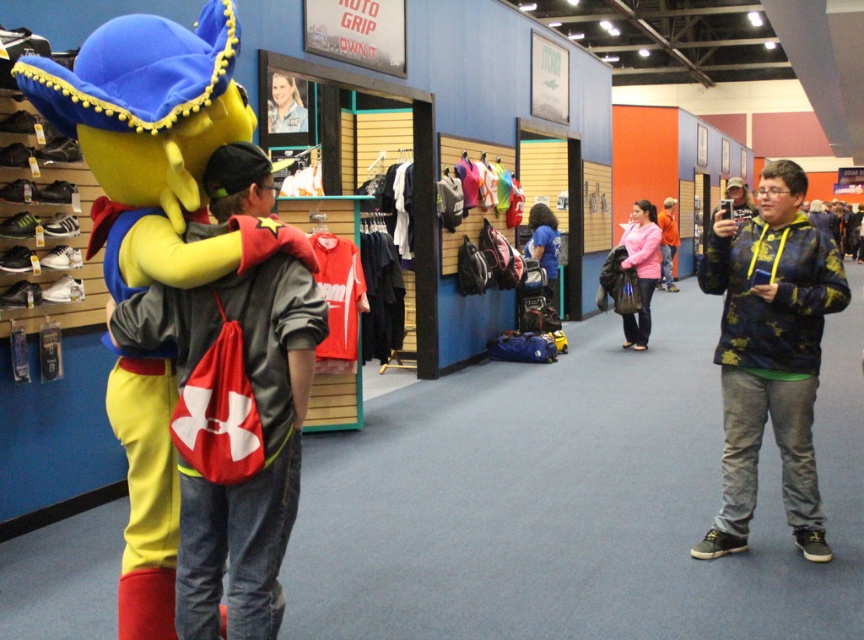
You are standing at the entrance of the store and want to move towards the two points marked in the image. Which point, point 1 at coordinates (812, 529) or point 2 at coordinates (270, 104), is closer to you?

Point 1 at coordinates (812, 529) is closer to you than point 2 at coordinates (270, 104).